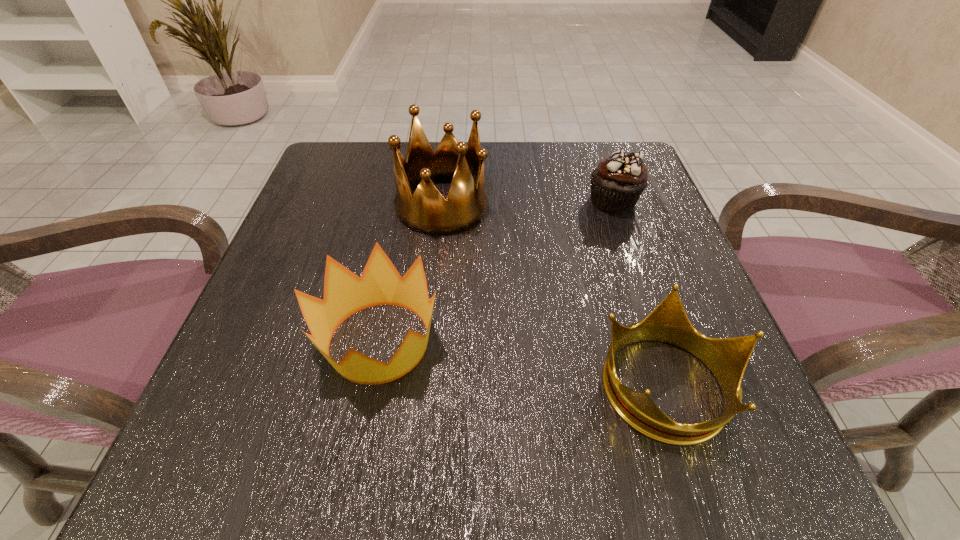
You are a GUI agent. You are given a task and a screenshot of the screen. Output one action in this format:
    pyautogui.click(x=<x>, y=<y>)
    Task: Click on the object that is at the left edge
    The width and height of the screenshot is (960, 540).
    Given the screenshot: What is the action you would take?
    pyautogui.click(x=345, y=293)

This screenshot has width=960, height=540. Find the location of `cupcake located at the right edge`. cupcake located at the right edge is located at coordinates (616, 184).

I want to click on crown that is at the right edge, so pos(727,358).

This screenshot has height=540, width=960. Find the location of `object that is at the far right corner`. object that is at the far right corner is located at coordinates (616, 184).

Identify the location of object that is at the near right corner. The width and height of the screenshot is (960, 540). (727, 358).

Find the location of a particular element. The width and height of the screenshot is (960, 540). vacant region at the far edge of the desktop is located at coordinates (534, 200).

In the image, there is a desktop. Find the location of `vacant space at the near edge`. vacant space at the near edge is located at coordinates (644, 481).

Where is `free space at the left edge of the desktop`? The image size is (960, 540). free space at the left edge of the desktop is located at coordinates (320, 205).

In the image, there is a desktop. Identify the location of free space at the right edge. This screenshot has width=960, height=540. (667, 384).

Identify the location of vacant space at the far left corner of the desktop. tap(332, 171).